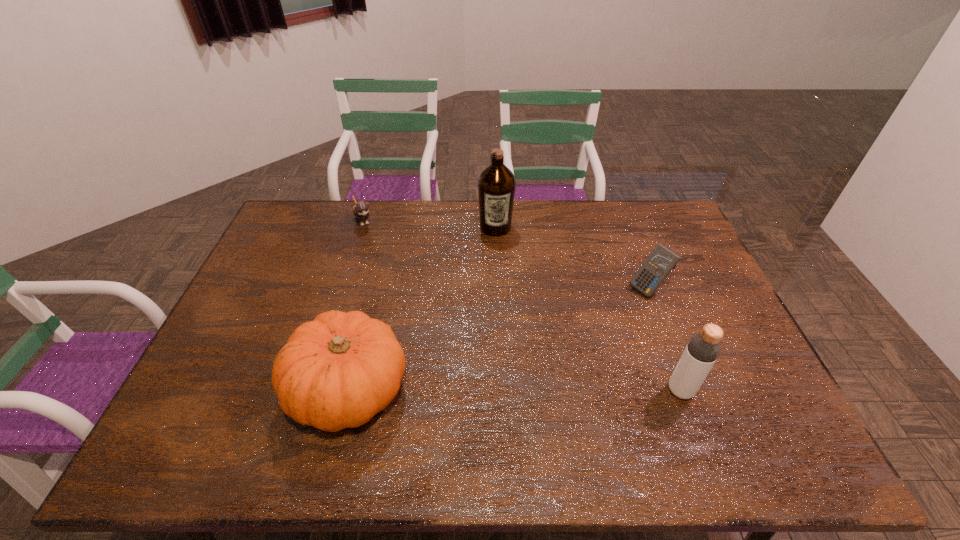
I want to click on vacant area situated 0.400m on the front-facing side of the calculator, so 544,366.

I want to click on vacant space situated 0.090m on the front-facing side of the calculator, so click(x=617, y=309).

Where is `free point located 0.360m on the label of the tallest object`? free point located 0.360m on the label of the tallest object is located at coordinates (502, 316).

You are a GUI agent. You are given a task and a screenshot of the screen. Output one action in this format:
    pyautogui.click(x=<x>, y=<y>)
    Task: Click on the free space located on the label of the tallest object
    The image size is (960, 540).
    Given the screenshot: What is the action you would take?
    pyautogui.click(x=500, y=294)

The image size is (960, 540). In order to click on vacant region located 0.140m on the label of the tallest object in this screenshot , I will do `click(498, 265)`.

Where is `blank space located 0.200m on the front-facing side of the shortest object`? The image size is (960, 540). blank space located 0.200m on the front-facing side of the shortest object is located at coordinates (386, 263).

Where is `vacant space situated on the front-facing side of the shortest object`? vacant space situated on the front-facing side of the shortest object is located at coordinates (377, 249).

Find the location of a particular element. free region located on the front-facing side of the shortest object is located at coordinates (403, 294).

At what (x,y) coordinates should I click in order to perform the action: click on olive oil present at the far edge. Please return your answer as a coordinate pair (x, y). The width and height of the screenshot is (960, 540). Looking at the image, I should click on (496, 185).

Where is `kitten that is at the far edge`? This screenshot has height=540, width=960. kitten that is at the far edge is located at coordinates (360, 209).